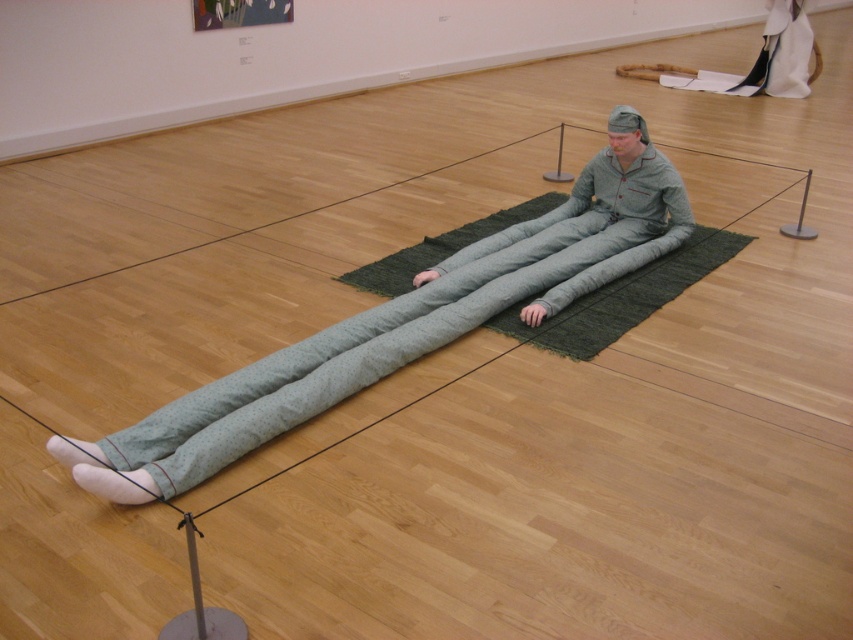
Based on the scene described, which object is taller between the green fabric figure at center and the green woven mat at center?

The green fabric figure at center is much taller than the green woven mat at center.

You are an art curator planning to move the green fabric figure at center and the green woven mat at center closer to the entrance for a new exhibition. The gallery requires that the distance between them must be exactly 12 inches. Given their current distance is 16.42 inches, how much closer do you need to move them?

The current distance between the green fabric figure at center and the green woven mat at center is 16.42 inches. To reduce it to 12 inches, you need to move them closer by 4.42 inches.